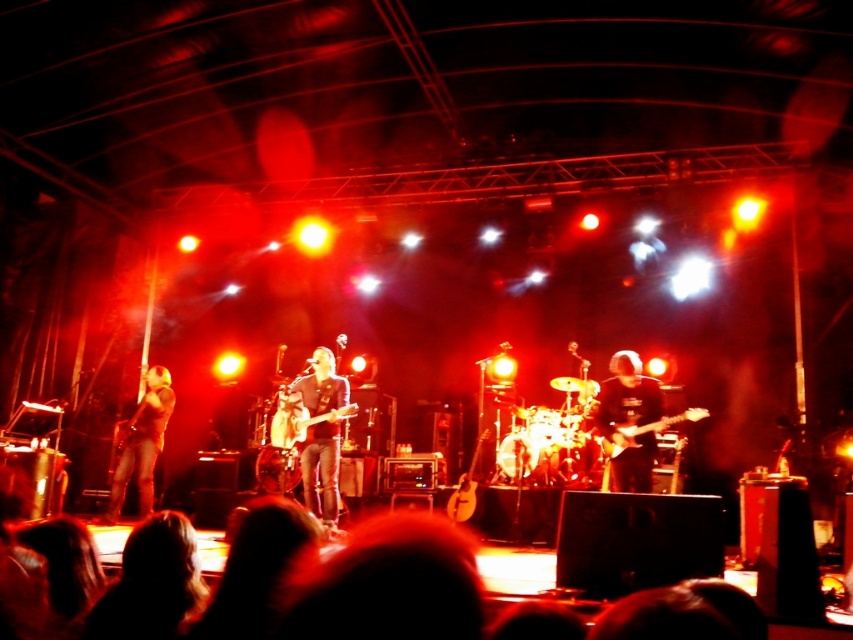
Question: Which object is closer to the camera taking this photo?

Choices:
 (A) matte black electric guitar at center
 (B) dark blue fabric shirt at center
 (C) dark blue shirt at center

Answer: (A)

Question: Which object is closer to the camera taking this photo?

Choices:
 (A) dark blue fabric shirt at center
 (B) dark blue shirt at center
 (C) matte black electric guitar at center
 (D) leather jacket at left

Answer: (C)

Question: Which point is farther to the camera?

Choices:
 (A) (154, 385)
 (B) (328, 508)

Answer: (A)

Question: Can you confirm if dark blue shirt at center is positioned to the right of leather jacket at left?

Choices:
 (A) yes
 (B) no

Answer: (A)

Question: Is leather jacket at left below matte black electric guitar at center?

Choices:
 (A) yes
 (B) no

Answer: (A)

Question: Is dark blue shirt at center above dark blue fabric shirt at center?

Choices:
 (A) yes
 (B) no

Answer: (A)